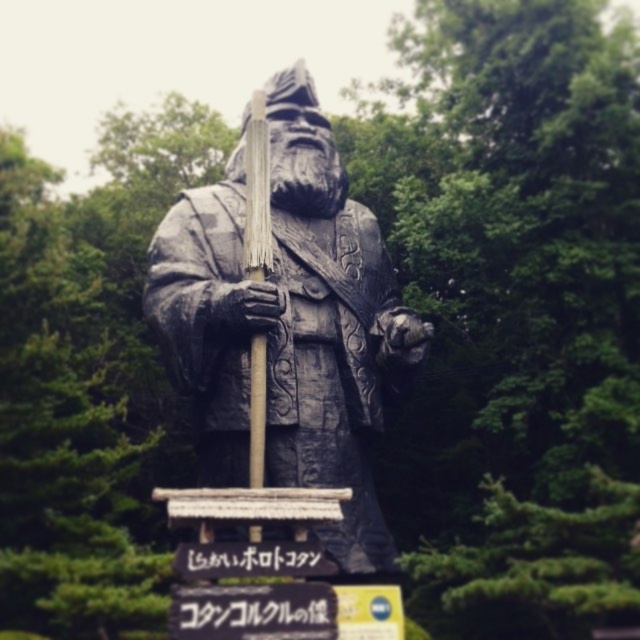
Question: Can you confirm if bronze statue at center is smaller than black plastic sign at center?

Choices:
 (A) no
 (B) yes

Answer: (A)

Question: Can you confirm if bronze statue at center is positioned to the right of black plastic sign at center?

Choices:
 (A) no
 (B) yes

Answer: (B)

Question: Which point is farther from the camera taking this photo?

Choices:
 (A) (220, 621)
 (B) (209, 346)

Answer: (B)

Question: Among these objects, which one is nearest to the camera?

Choices:
 (A) black plastic sign at center
 (B) bronze statue at center

Answer: (A)

Question: Does bronze statue at center have a smaller size compared to black plastic sign at center?

Choices:
 (A) no
 (B) yes

Answer: (A)